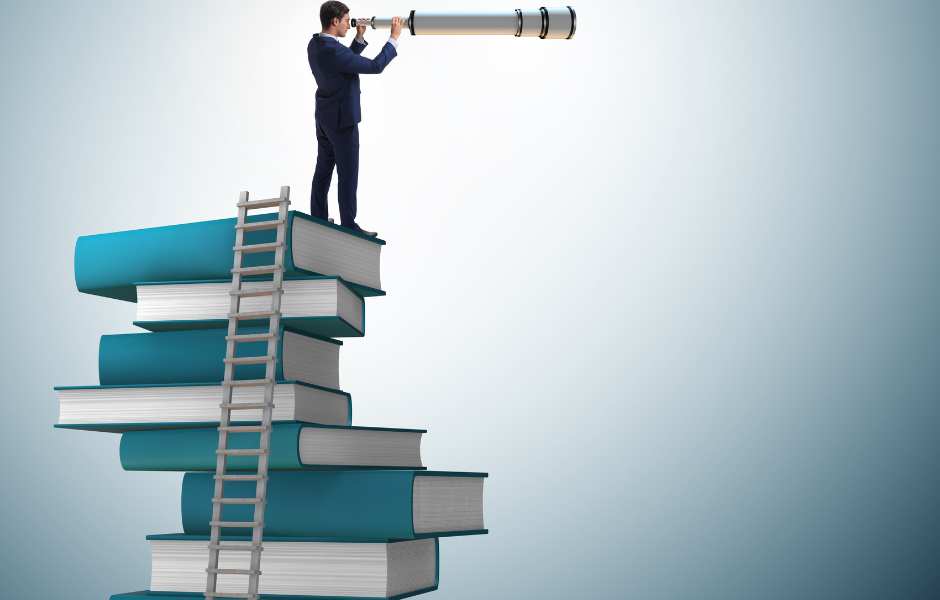
Where is `books`? This screenshot has width=940, height=600. books is located at coordinates (178, 255), (194, 308), (176, 348), (137, 399), (311, 511), (311, 556), (342, 447).